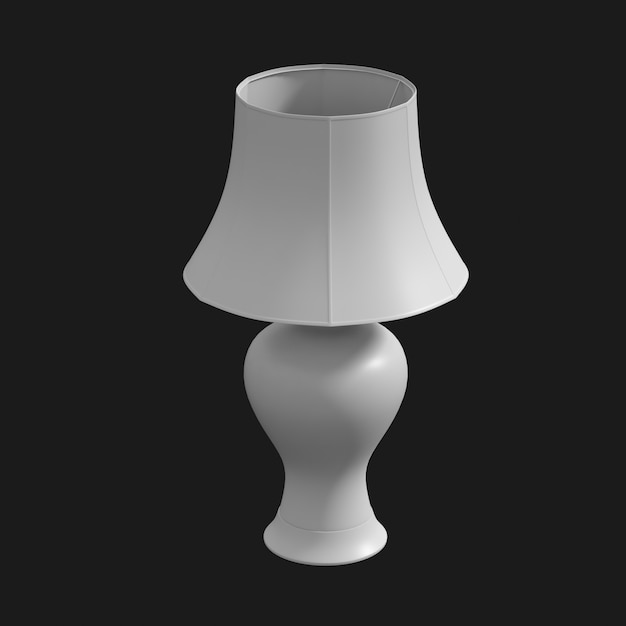
Where is `rim of shade`? The width and height of the screenshot is (626, 626). rim of shade is located at coordinates (327, 295), (329, 211), (326, 150).